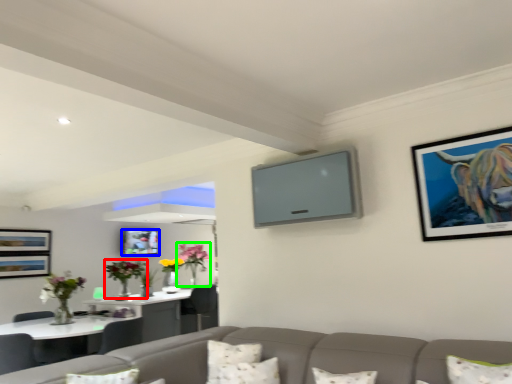
Question: Estimate the real-world distances between objects in this image. Which object is farther from floral arrangement (highlighted by a red box), picture frame (highlighted by a blue box) or floral arrangement (highlighted by a green box)?

Choices:
 (A) picture frame
 (B) floral arrangement

Answer: (B)